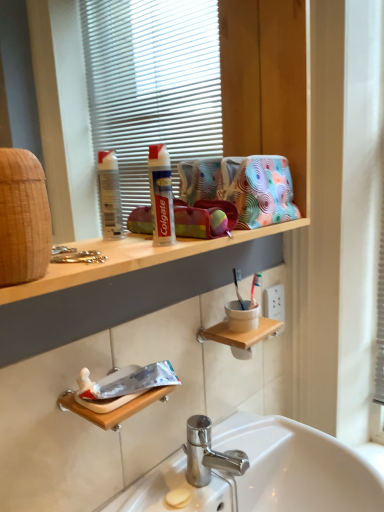
In order to click on white glossy sink at lower center in this screenshot , I will do `click(297, 467)`.

What do you see at coordinates (297, 467) in the screenshot? Image resolution: width=384 pixels, height=512 pixels. I see `white glossy sink at lower center` at bounding box center [297, 467].

Locate an element on the screen. This screenshot has width=384, height=512. white glossy sink at lower center is located at coordinates (297, 467).